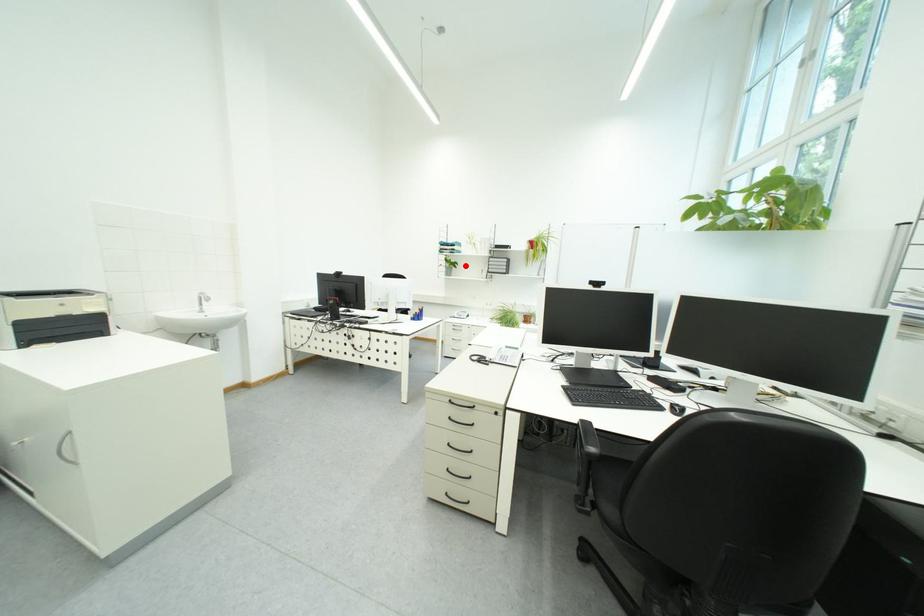
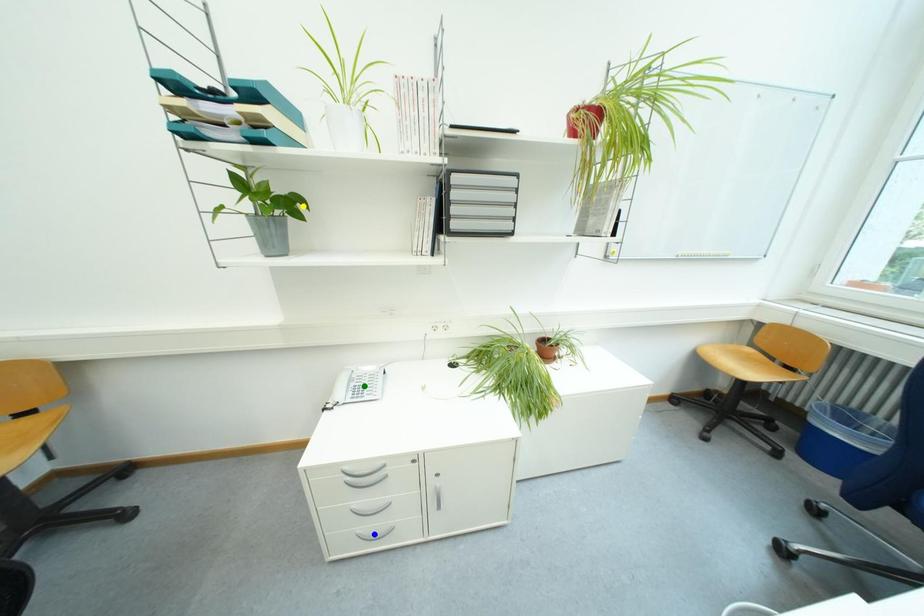
Question: I am providing you with two images of the same scene from different viewpoints. A red point is marked on the first image. You are given multiple points on the second image. Can you choose the point in image 2 that corresponds to the point in image 1?

Choices:
 (A) blue point
 (B) green point
 (C) yellow point

Answer: (C)